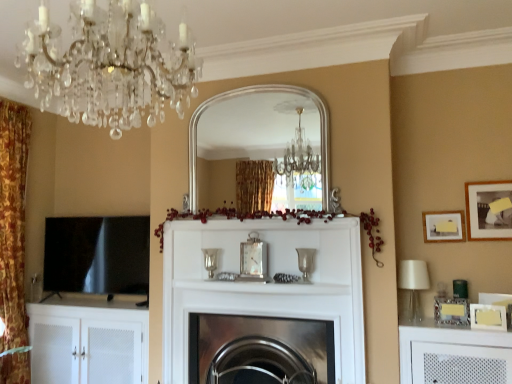
Image resolution: width=512 pixels, height=384 pixels. Describe the element at coordinates (260, 350) in the screenshot. I see `stainless steel fireplace at center` at that location.

How much space does white matte picture frame at upper right, positioned as the 2th picture frame in bottom-to-top order, occupy vertically?

16.89 centimeters.

This screenshot has height=384, width=512. What do you see at coordinates (13, 221) in the screenshot?
I see `orange floral fabric curtain at left` at bounding box center [13, 221].

Describe the element at coordinates (451, 311) in the screenshot. I see `metallic silver picture frame at right, the 4th picture frame in the top-to-bottom sequence` at that location.

At what (x,y) coordinates should I click in order to perform the action: click on white glass lampshade at right. Please return your answer as a coordinate pair (x, y). Looking at the image, I should click on (413, 285).

I want to click on stainless steel fireplace at center, so click(260, 350).

Locate an element on the screen. the 3rd picture frame above the stainless steel fireplace at center (from a real-world perspective) is located at coordinates (444, 226).

Looking at this image, who is bigger, stainless steel fireplace at center or matte white picture frame at upper right, the 2th picture frame viewed from the top?

With larger size is stainless steel fireplace at center.

Is stainless steel fireplace at center facing towards matte white picture frame at upper right, marked as the third picture frame in a bottom-to-top arrangement?

No, stainless steel fireplace at center is not turned towards matte white picture frame at upper right, marked as the third picture frame in a bottom-to-top arrangement.

Measure the distance between stainless steel fireplace at center and matte white picture frame at upper right, marked as the third picture frame in a bottom-to-top arrangement.

stainless steel fireplace at center and matte white picture frame at upper right, marked as the third picture frame in a bottom-to-top arrangement, are 1.29 meters apart.

Is crystal glass chandelier at upper left taller or shorter than white matte cabinet at left?

Result: In the image, crystal glass chandelier at upper left appears to be shorter than white matte cabinet at left.

From the image's perspective, is crystal glass chandelier at upper left on top of white matte cabinet at left?

Yes, from the image's perspective, crystal glass chandelier at upper left is over white matte cabinet at left.

In the scene shown: From a real-world perspective, is crystal glass chandelier at upper left beneath white matte cabinet at left?

Actually, crystal glass chandelier at upper left is physically above white matte cabinet at left in the real world.

What's the angular difference between crystal glass chandelier at upper left and white matte cabinet at left's facing directions?

They differ by 86.2 degrees in their facing directions.

Between point (499, 320) and point (113, 221), which one is positioned in front?

Positioned in front is point (499, 320).

Is black glossy tv at left located within white matte picture frame at upper right, positioned as the 2th picture frame in bottom-to-top order?

No, black glossy tv at left is located outside of white matte picture frame at upper right, positioned as the 2th picture frame in bottom-to-top order.

Is white matte picture frame at upper right, which is counted as the 3th picture frame, starting from the top, oriented towards black glossy tv at left?

No, white matte picture frame at upper right, which is counted as the 3th picture frame, starting from the top, is not facing towards black glossy tv at left.

How different are the orientations of white matte picture frame at upper right, which is counted as the 3th picture frame, starting from the top, and black glossy tv at left in degrees?

The angular difference between white matte picture frame at upper right, which is counted as the 3th picture frame, starting from the top, and black glossy tv at left is 11.6 degrees.

Consider the image. Is white glass lampshade at right shorter than black glossy tv at left?

Yes.

Is white glass lampshade at right to the left or to the right of black glossy tv at left in the image?

white glass lampshade at right is to the right of black glossy tv at left.

Is white glass lampshade at right positioned with its back to black glossy tv at left?

No.

Can you confirm if white glass lampshade at right is thinner than black glossy tv at left?

No.

Which object is closer to the camera taking this photo, matte white picture frame at upper right, the 2th picture frame viewed from the top, or white matte picture frame at upper right, which is counted as the 3th picture frame, starting from the top?

Positioned in front is white matte picture frame at upper right, which is counted as the 3th picture frame, starting from the top.

From a real-world perspective, is matte white picture frame at upper right, the 2th picture frame viewed from the top, physically located above or below white matte picture frame at upper right, which is counted as the 3th picture frame, starting from the top?

Clearly, from a real-world perspective, matte white picture frame at upper right, the 2th picture frame viewed from the top, is above white matte picture frame at upper right, which is counted as the 3th picture frame, starting from the top.

Considering the positions of point (436, 231) and point (498, 317), is point (436, 231) closer or farther from the camera than point (498, 317)?

Point (436, 231) is farther from the camera than point (498, 317).

Is point (282, 107) farther from viewer compared to point (34, 348)?

That is True.

Is white matte cabinet at left inside silver/metallic mirror at center?

That's incorrect, white matte cabinet at left is not inside silver/metallic mirror at center.

Are silver/metallic mirror at center and white matte cabinet at left beside each other?

No.

How far apart are silver/metallic mirror at center and white matte cabinet at left?

silver/metallic mirror at center and white matte cabinet at left are 8.48 feet apart from each other.

Is crystal glass chandelier at upper left further to camera compared to metallic silver picture frame at right, which is counted as the 1th picture frame, starting from the bottom?

That is False.

In the scene shown: Based on their sizes in the image, would you say crystal glass chandelier at upper left is bigger or smaller than metallic silver picture frame at right, the 4th picture frame in the top-to-bottom sequence?

Considering their sizes, crystal glass chandelier at upper left takes up more space than metallic silver picture frame at right, the 4th picture frame in the top-to-bottom sequence.

Is point (100, 42) closer or farther from the camera than point (438, 308)?

Point (100, 42) appears to be closer to the viewer than point (438, 308).

From the image's perspective, which is below, crystal glass chandelier at upper left or metallic silver picture frame at right, the 4th picture frame in the top-to-bottom sequence?

metallic silver picture frame at right, the 4th picture frame in the top-to-bottom sequence, is shown below in the image.

From the stainless steel fireplace at center, count 3rd picture frames backward and point to it. Please provide its 2D coordinates.

[(444, 226)]

The width and height of the screenshot is (512, 384). I want to click on light fixture above the white matte cabinet at left (from the image's perspective), so click(x=109, y=66).

From the image, which object appears to be nearer to metallic silver picture frame at right, the 4th picture frame in the top-to-bottom sequence, white glass lampshade at right or orange floral fabric curtain at left?

white glass lampshade at right is positioned closer to the anchor metallic silver picture frame at right, the 4th picture frame in the top-to-bottom sequence.

From the image, which object appears to be farther from black glossy tv at left, metallic silver picture frame at right, the 4th picture frame in the top-to-bottom sequence, or orange floral fabric curtain at left?

Among the two, metallic silver picture frame at right, the 4th picture frame in the top-to-bottom sequence, is located further to black glossy tv at left.

Which object lies nearer to the anchor point white matte cabinet at left, metallic silver picture frame at right, which is counted as the 1th picture frame, starting from the bottom, or stainless steel fireplace at center?

stainless steel fireplace at center.

Which object lies further to the anchor point white matte cabinet at left, stainless steel fireplace at center or white glass lampshade at right?

white glass lampshade at right is further to white matte cabinet at left.

Based on their spatial positions, is crystal glass chandelier at upper left or white matte cabinet at left closer to matte white picture frame at upper right, the 2th picture frame viewed from the top?

crystal glass chandelier at upper left lies closer to matte white picture frame at upper right, the 2th picture frame viewed from the top, than the other object.

Based on their spatial positions, is matte white picture frame at upper right, the 2th picture frame viewed from the top, or white matte cabinet at left further from black glossy tv at left?

Based on the image, matte white picture frame at upper right, the 2th picture frame viewed from the top, appears to be further to black glossy tv at left.

Based on the photo, considering their positions, is stainless steel fireplace at center positioned further to black glossy tv at left than matte silver picture frame at upper right, the first picture frame positioned from the top?

The object further to black glossy tv at left is matte silver picture frame at upper right, the first picture frame positioned from the top.

Estimate the real-world distances between objects in this image. Which object is closer to black glossy tv at left, matte white picture frame at upper right, marked as the third picture frame in a bottom-to-top arrangement, or metallic silver picture frame at right, the 4th picture frame in the top-to-bottom sequence?

matte white picture frame at upper right, marked as the third picture frame in a bottom-to-top arrangement, is closer to black glossy tv at left.

Where is `mirror between crystal glass chandelier at upper left and white matte cabinet at left in the front-back direction`? mirror between crystal glass chandelier at upper left and white matte cabinet at left in the front-back direction is located at coordinates (253, 129).

At what (x,y) coordinates should I click in order to perform the action: click on light fixture between orange floral fabric curtain at left and matte silver picture frame at upper right, the 4th picture frame positioned from the bottom, from left to right. Please return your answer as a coordinate pair (x, y). The height and width of the screenshot is (384, 512). Looking at the image, I should click on (109, 66).

The width and height of the screenshot is (512, 384). I want to click on picture frame between black glossy tv at left and matte white picture frame at upper right, the 2th picture frame viewed from the top, in the horizontal direction, so click(451, 311).

The image size is (512, 384). What are the coordinates of `picture frame between matte silver picture frame at upper right, the first picture frame positioned from the top, and white matte picture frame at upper right, positioned as the 2th picture frame in bottom-to-top order, vertically` in the screenshot? It's located at (444, 226).